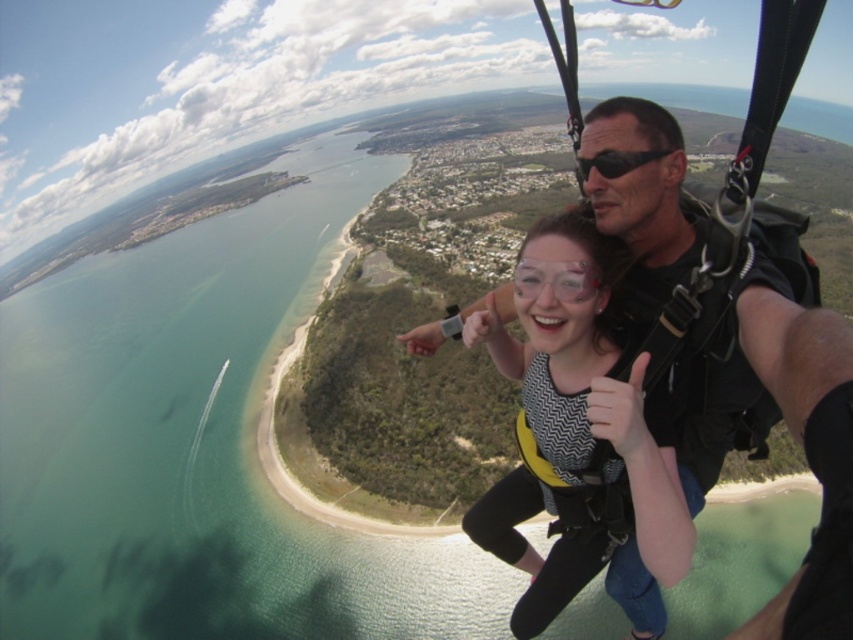
Does matte black harness at center come behind black matte goggles at upper center?

No.

Is point (535, 454) positioned behind point (625, 161)?

That is True.

I want to click on matte black harness at center, so click(x=573, y=422).

Is yellow fabric harness at center wider than black matte goggles at upper center?

Yes, yellow fabric harness at center is wider than black matte goggles at upper center.

Is yellow fabric harness at center taller than black matte goggles at upper center?

Indeed, yellow fabric harness at center has a greater height compared to black matte goggles at upper center.

The width and height of the screenshot is (853, 640). Describe the element at coordinates (642, 196) in the screenshot. I see `yellow fabric harness at center` at that location.

Where is `yellow fabric harness at center`? yellow fabric harness at center is located at coordinates (642, 196).

Consider the image. Can you confirm if matte black harness at center is positioned below yellow fabric harness at center?

Correct, matte black harness at center is located below yellow fabric harness at center.

Is matte black harness at center positioned behind yellow fabric harness at center?

Yes, matte black harness at center is further from the viewer.

Between point (547, 220) and point (775, 397), which one is positioned behind?

Positioned behind is point (547, 220).

The height and width of the screenshot is (640, 853). In order to click on matte black harness at center in this screenshot , I will do `click(573, 422)`.